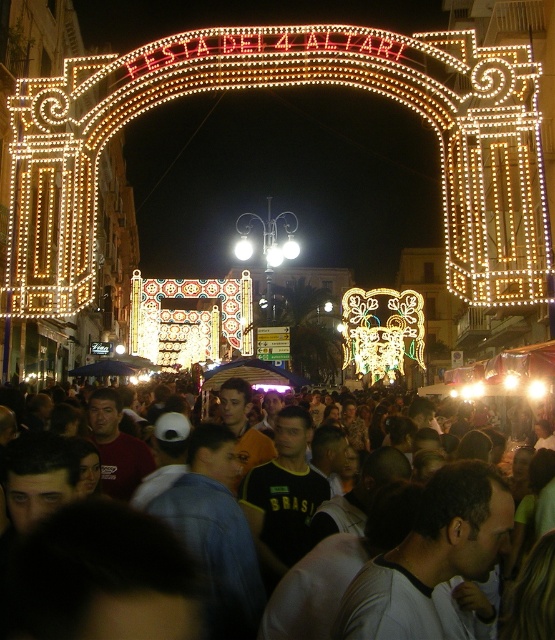
Question: Does illuminated neon sign at upper center have a smaller size compared to dark gray clothing at center?

Choices:
 (A) yes
 (B) no

Answer: (B)

Question: Which object appears closest to the camera in this image?

Choices:
 (A) illuminated neon sign at upper center
 (B) dark gray clothing at center

Answer: (B)

Question: Which object appears farthest from the camera in this image?

Choices:
 (A) illuminated neon sign at upper center
 (B) dark gray clothing at center

Answer: (A)

Question: Does illuminated neon sign at upper center have a smaller size compared to dark gray clothing at center?

Choices:
 (A) yes
 (B) no

Answer: (B)

Question: Can you confirm if illuminated neon sign at upper center is bigger than dark gray clothing at center?

Choices:
 (A) yes
 (B) no

Answer: (A)

Question: Which object appears farthest from the camera in this image?

Choices:
 (A) dark gray clothing at center
 (B) illuminated neon sign at upper center

Answer: (B)